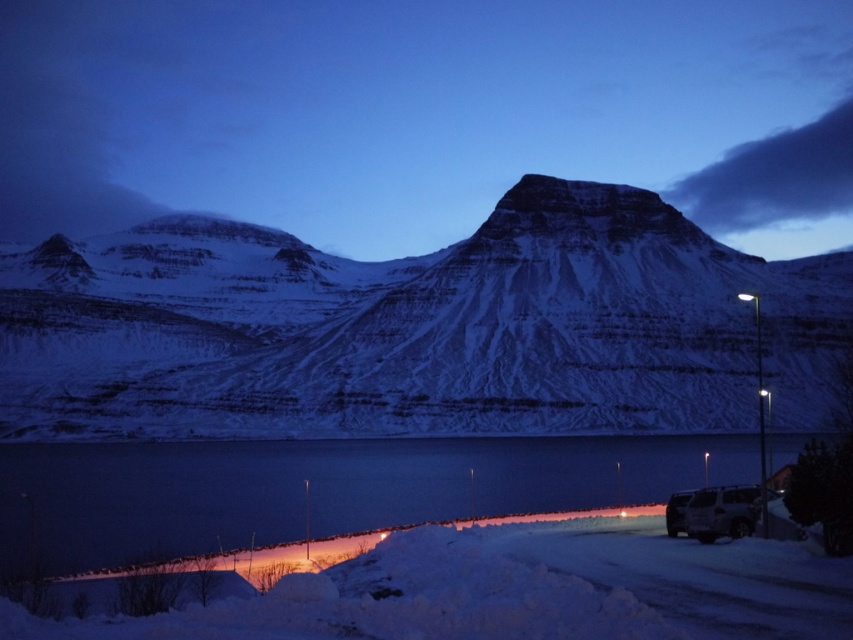
Question: Is white powdery snow at lower center to the right of silver metallic van at lower right from the viewer's perspective?

Choices:
 (A) yes
 (B) no

Answer: (B)

Question: Among these points, which one is farthest from the camera?

Choices:
 (A) (763, 632)
 (B) (103, 496)
 (C) (738, 508)
 (D) (799, 289)

Answer: (D)

Question: Is snowy mountain at center smaller than white powdery snow at lower center?

Choices:
 (A) yes
 (B) no

Answer: (B)

Question: Which object is the closest to the white snow-covered mountain at center?

Choices:
 (A) white powdery snow at lower center
 (B) snowy mountain at center
 (C) silver metallic van at lower right

Answer: (A)

Question: In this image, where is snowy mountain at center located relative to white snow-covered mountain at center?

Choices:
 (A) above
 (B) below

Answer: (A)

Question: Estimate the real-world distances between objects in this image. Which object is closer to the snowy mountain at center?

Choices:
 (A) silver metallic van at lower right
 (B) white powdery snow at lower center
 (C) white snow-covered mountain at center
 (D) smooth ice lake at lower center

Answer: (C)